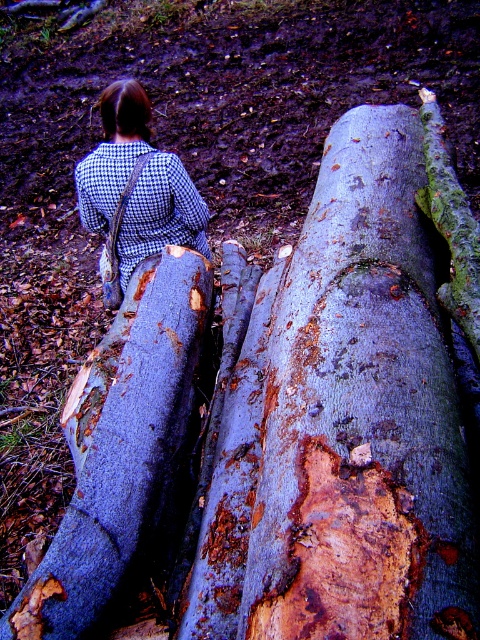
Looking at this image, you are a hiker who wants to cross over the rusty bark log at center. You are wearing the checkered fabric coat at center. Can your coat fit entirely on the log without hanging off the sides?

The rusty bark log at center has a larger width than the checkered fabric coat at center, so yes, the checkered fabric coat at center can fit entirely on the log without hanging off the sides.

You are a hiker who wants to place your checkered fabric coat at center on top of the rusty wood log at center. Can you do that?

The rusty wood log at center has a greater height compared to the checkered fabric coat at center, so yes, you can place the checkered fabric coat at center on top of the rusty wood log at center since it is taller than the coat.

You are a hiker who has just arrived at this forest area. You notice two logs at the center of the scene. Which log, the rusty bark log at center or the rusty wood log at center, is positioned higher up?

The rusty bark log at center is positioned higher up because it is above the rusty wood log at center.